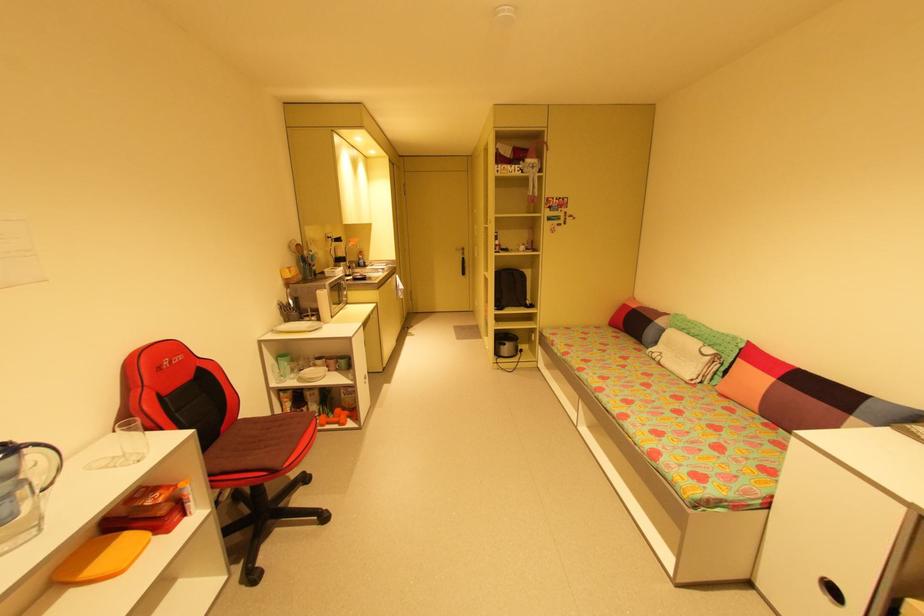
This screenshot has height=616, width=924. What do you see at coordinates (43, 463) in the screenshot?
I see `a metal faucet handle` at bounding box center [43, 463].